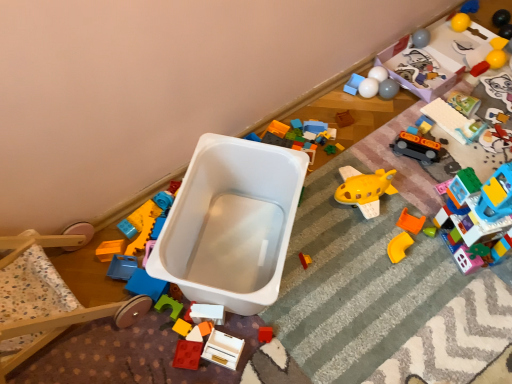
Find the location of a particular element. vacant area that is in front of orange plastic train at center, which ranks as the sixth toy in right-to-left order is located at coordinates (x=415, y=191).